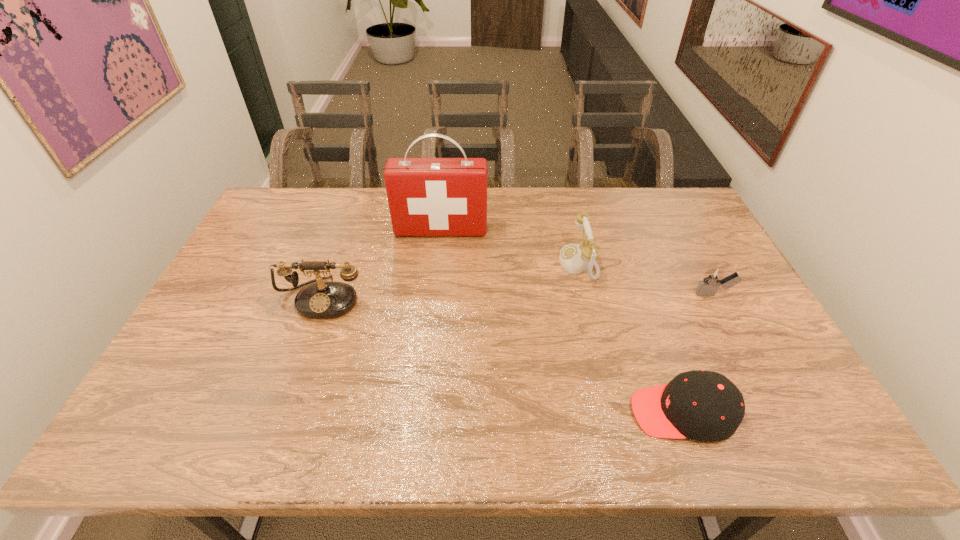
In the image, there is a desktop. Identify the location of vacant space at the near edge. (287, 448).

Where is `vacant space at the left edge`? This screenshot has height=540, width=960. vacant space at the left edge is located at coordinates (265, 275).

The width and height of the screenshot is (960, 540). In the image, there is a desktop. In order to click on vacant space at the right edge in this screenshot , I will do `click(721, 319)`.

In the image, there is a desktop. Find the location of `vacant space at the far left corner`. vacant space at the far left corner is located at coordinates (286, 222).

I want to click on vacant space that is in between the cap and the third shortest object, so click(x=630, y=338).

At what (x,y) coordinates should I click in order to perform the action: click on free space between the shorter telephone and the cap. Please return your answer as a coordinate pair (x, y). This screenshot has width=960, height=540. Looking at the image, I should click on (630, 338).

What are the coordinates of `empty space that is in between the right telephone and the nearest object` in the screenshot? It's located at (630, 338).

Image resolution: width=960 pixels, height=540 pixels. I want to click on free space between the nearest object and the left telephone, so click(503, 355).

At what (x,y) coordinates should I click in order to perform the action: click on free space that is in between the farthest object and the cap. Please return your answer as a coordinate pair (x, y). Looking at the image, I should click on (562, 321).

Find the location of a particular element. The height and width of the screenshot is (540, 960). vacant area that lies between the rightmost object and the right telephone is located at coordinates (646, 279).